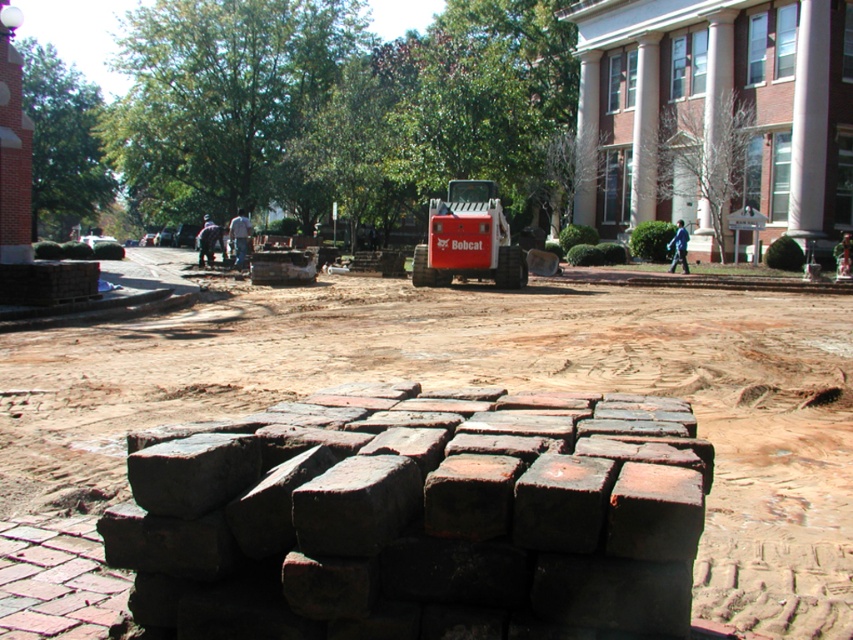
Between brown dirt field at center and red rubber bobcat at center, which one is positioned lower?

brown dirt field at center is lower down.

Is brown dirt field at center above red rubber bobcat at center?

Incorrect, brown dirt field at center is not positioned above red rubber bobcat at center.

The image size is (853, 640). What do you see at coordinates (495, 385) in the screenshot?
I see `brown dirt field at center` at bounding box center [495, 385].

This screenshot has height=640, width=853. I want to click on brown dirt field at center, so click(495, 385).

Is brown dirt field at center positioned behind dark red brick at center?

That is True.

Is brown dirt field at center taller than dark red brick at center?

Yes, brown dirt field at center is taller than dark red brick at center.

Describe the element at coordinates (495, 385) in the screenshot. Image resolution: width=853 pixels, height=640 pixels. I see `brown dirt field at center` at that location.

Where is `brown dirt field at center`? brown dirt field at center is located at coordinates (495, 385).

Between dark red brick at center and red rubber bobcat at center, which one appears on the left side from the viewer's perspective?

Positioned to the left is dark red brick at center.

Which is in front, point (236, 433) or point (425, 266)?

Positioned in front is point (236, 433).

The image size is (853, 640). What are the coordinates of `dark red brick at center` in the screenshot? It's located at click(416, 518).